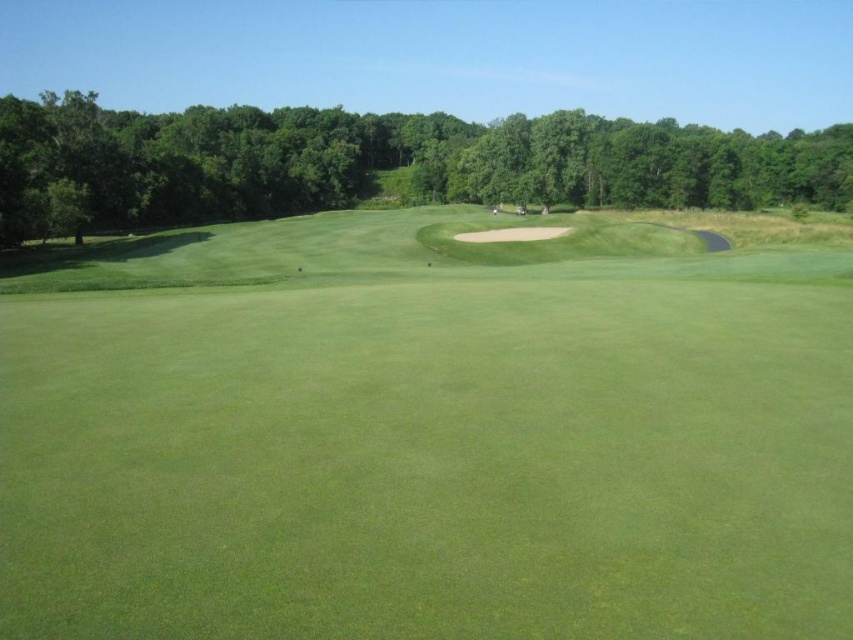
Question: Is green grassy fairway at center positioned in front of green leafy tree at upper center?

Choices:
 (A) no
 (B) yes

Answer: (B)

Question: Which of the following is the farthest from the observer?

Choices:
 (A) green grassy fairway at center
 (B) green leafy tree at upper center

Answer: (B)

Question: Considering the relative positions of green grassy fairway at center and green leafy tree at upper center in the image provided, where is green grassy fairway at center located with respect to green leafy tree at upper center?

Choices:
 (A) right
 (B) left

Answer: (B)

Question: Which of the following is the farthest from the observer?

Choices:
 (A) (624, 150)
 (B) (30, 579)

Answer: (A)

Question: Does green grassy fairway at center come behind green leafy tree at upper center?

Choices:
 (A) yes
 (B) no

Answer: (B)